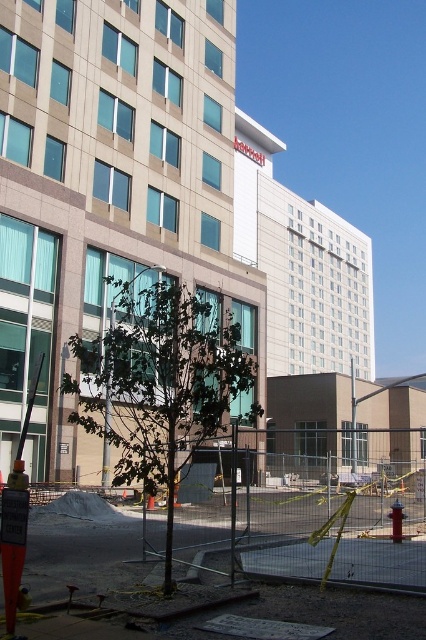
You are a delivery driver who needs to enter the construction site through the metal mesh fence at center. However, you must first determine if the entrance is on the left or right side of the white smooth hotel at upper center. Based on the scene, which side should you approach?

The metal mesh fence at center is to the left of the white smooth hotel at upper center, so you should approach the entrance on the left side of the white smooth hotel at upper center.

You are a delivery person trying to enter the construction site to drop off supplies. You see the metal mesh fence at center and the green leafy tree at center. Which one is bigger in size?

The metal mesh fence at center is larger in size than the green leafy tree at center.